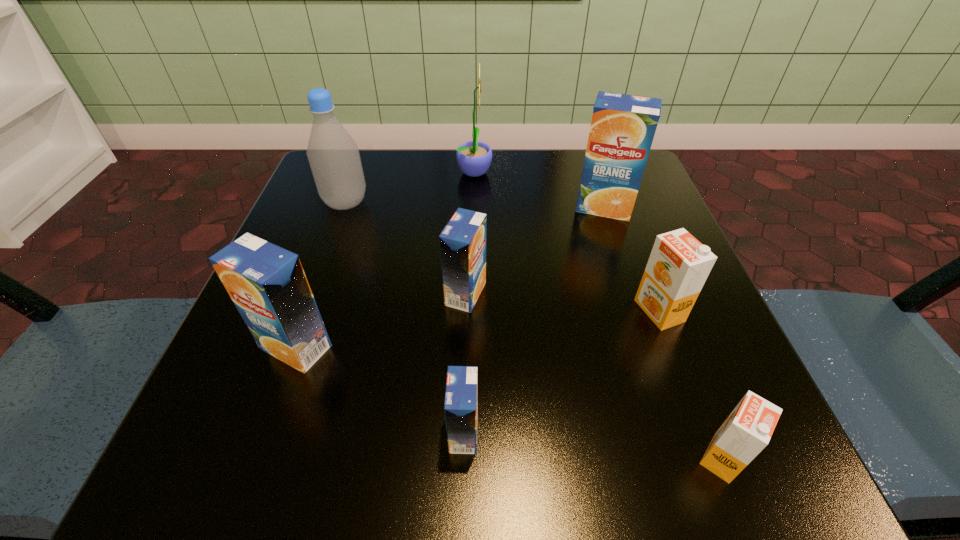
Locate an element on the screen. The height and width of the screenshot is (540, 960). orange_juice that is at the far edge is located at coordinates (622, 130).

You are a GUI agent. You are given a task and a screenshot of the screen. Output one action in this format:
    pyautogui.click(x=<x>, y=<y>)
    Task: Click on the bottle located at the left edge
    The width and height of the screenshot is (960, 540).
    Given the screenshot: What is the action you would take?
    pyautogui.click(x=334, y=158)

Where is `orange_juice that is at the left edge`? Image resolution: width=960 pixels, height=540 pixels. orange_juice that is at the left edge is located at coordinates (267, 283).

Identify the location of object at the far left corner. (334, 158).

You are a GUI agent. You are given a task and a screenshot of the screen. Output one action in this format:
    pyautogui.click(x=<x>, y=<y>)
    Task: Click on the object that is at the far right corner
    
    Given the screenshot: What is the action you would take?
    pyautogui.click(x=622, y=130)

Where is `object located at the near right corner`? This screenshot has height=540, width=960. object located at the near right corner is located at coordinates (748, 429).

Find the location of a particular element. vacant space at the far edge of the desktop is located at coordinates (490, 179).

Identify the location of vacant space at the left edge. Image resolution: width=960 pixels, height=540 pixels. (243, 342).

Find the location of a particular element. vacant space at the right edge of the desktop is located at coordinates (688, 336).

Image resolution: width=960 pixels, height=540 pixels. What are the coordinates of `vacant position at the far left corner of the desktop` in the screenshot? It's located at (305, 210).